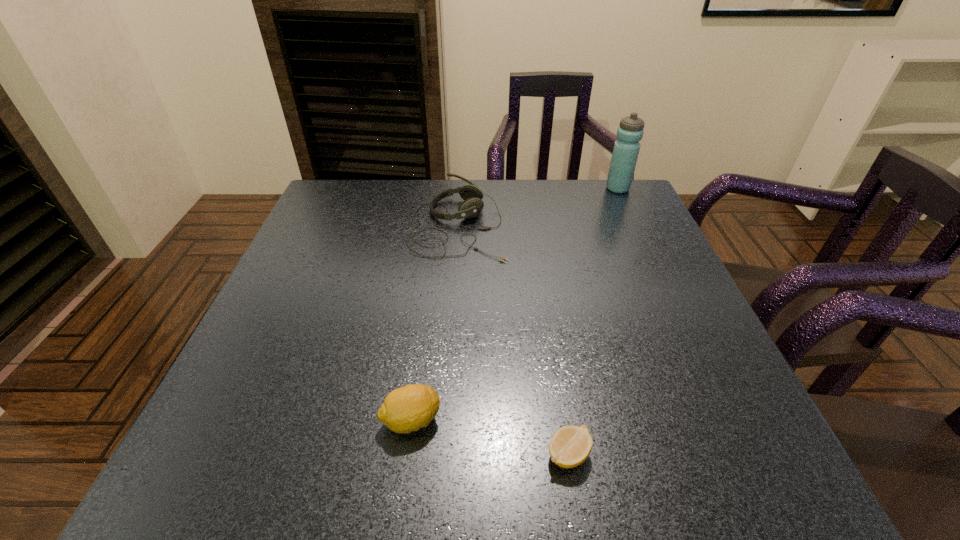
This screenshot has width=960, height=540. I want to click on water bottle located at the far edge, so click(626, 149).

Locate an element on the screen. This screenshot has height=540, width=960. headset at the far edge is located at coordinates (472, 205).

The height and width of the screenshot is (540, 960). I want to click on object that is positioned at the right edge, so click(x=626, y=149).

This screenshot has height=540, width=960. I want to click on object at the far right corner, so click(x=626, y=149).

Locate an element on the screen. vacant space at the far edge is located at coordinates (403, 225).

Image resolution: width=960 pixels, height=540 pixels. I want to click on vacant area at the right edge of the desktop, so click(x=650, y=248).

At what (x,y) coordinates should I click in order to perform the action: click on vacant region at the far left corner of the desktop. Please return your answer as a coordinate pair (x, y). Looking at the image, I should click on (330, 186).

In the image, there is a desktop. Find the location of `free space at the near left corner`. free space at the near left corner is located at coordinates (249, 469).

This screenshot has height=540, width=960. In the image, there is a desktop. Find the location of `vacant space at the far right corner`. vacant space at the far right corner is located at coordinates (602, 197).

Locate an element on the screen. The height and width of the screenshot is (540, 960). vacant space in between the left lemon and the farthest object is located at coordinates (515, 305).